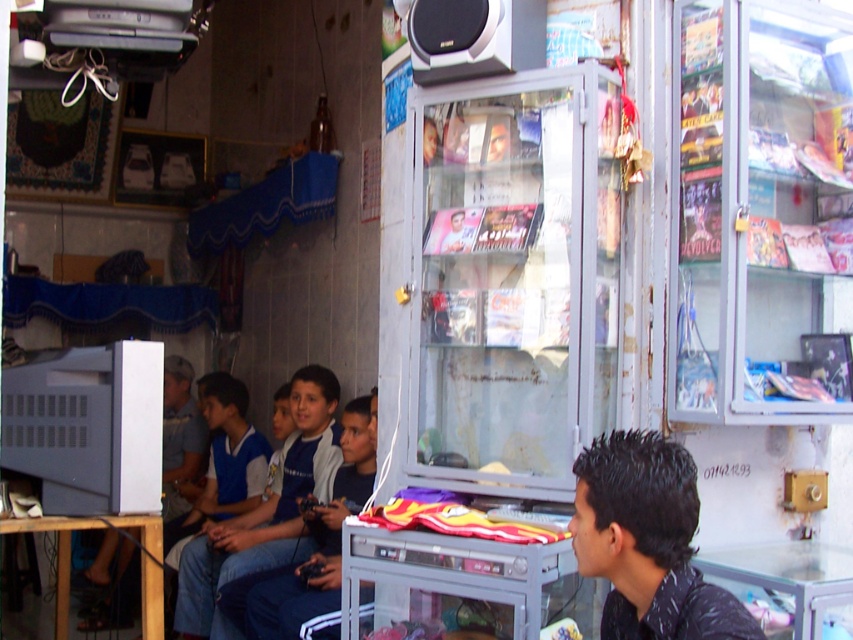
Based on the photo, you are a customer in the shop and want to know which object is narrower between the black matte hair at center and the blue jersey at center. Please answer based on the objects in the scene.

The black matte hair at center is thinner than the blue jersey at center, so the black matte hair at center is narrower.

Please provide the 2D coordinates of the blue jersey at center in the shop scene.

The blue jersey at center is located at the 2D coordinates of point [264,512].

You are a delivery person who needs to place a package between the dark blue jeans at center and the transparent arcade machine with a colorful display. The package is 3 meters long. Will it fit between them?

The distance between the dark blue jeans at center and the transparent arcade machine with a colorful display is 3.54 meters. Since the package is 3 meters long, it will fit between them as there is enough space.